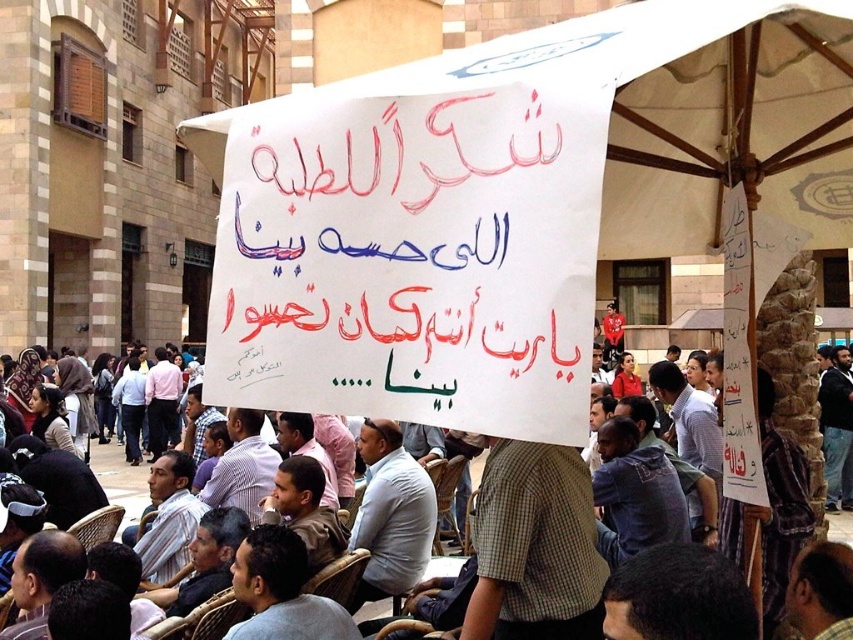
You are a photographer trying to capture the white paper sign at center and the wooden textured chair at center in the same frame. Based on their sizes, which object will appear larger in your photo?

The white paper sign at center will appear larger in the photo since it has a greater height compared to the wooden textured chair at center.

You are a photographer standing at the camera position. You want to capture a clear photo of the white paper sign at center. The camera has a minimum focus distance of 100 feet. Can you focus on the sign?

The white paper sign at center is 98.28 feet away from camera, which is less than the minimum focus distance of 100 feet. Therefore, the camera cannot focus on the sign.

You are a photographer taking a picture of the protest scene. You notice two points marked as point 1 at coordinates (123, 506) and point 2 at coordinates (76, 532). Which point is closer to your camera lens?

Point 1 at coordinates (123, 506) is closer to the camera lens because it is further to the viewer than point 2 at coordinates (76, 532).